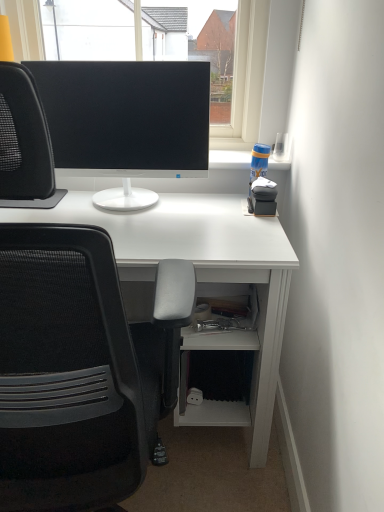
From the picture: What is the approximate height of black mesh chair at left?

black mesh chair at left is 1.17 meters in height.

Where is `black matte monitor at upper center`? black matte monitor at upper center is located at coordinates coord(220,55).

Considering the relative sizes of matte black monitor at center and black mesh chair at left in the image provided, is matte black monitor at center thinner than black mesh chair at left?

Indeed, matte black monitor at center has a lesser width compared to black mesh chair at left.

Does matte black monitor at center have a larger size compared to black mesh chair at left?

No.

From a real-world perspective, is matte black monitor at center located higher than black mesh chair at left?

Yes.

Which of these two, matte black monitor at center or black mesh chair at left, stands taller?

With more height is black mesh chair at left.

Where is `window screen located behind the black mesh chair at left`? The height and width of the screenshot is (512, 384). window screen located behind the black mesh chair at left is located at coordinates (220, 55).

Does black matte monitor at upper center appear on the left side of black mesh chair at left?

No, black matte monitor at upper center is not to the left of black mesh chair at left.

From the image's perspective, who appears lower, black matte monitor at upper center or black mesh chair at left?

From the image's view, black mesh chair at left is below.

Can you confirm if black mesh chair at left is positioned to the left of matte black monitor at center?

Correct, you'll find black mesh chair at left to the left of matte black monitor at center.

Based on the photo, considering the sizes of black mesh chair at left and matte black monitor at center in the image, is black mesh chair at left wider or thinner than matte black monitor at center?

black mesh chair at left is wider than matte black monitor at center.

This screenshot has width=384, height=512. I want to click on chair below the matte black monitor at center (from the image's perspective), so click(66, 373).

Is black mesh chair at left not within black matte monitor at upper center?

Yes, black mesh chair at left is outside of black matte monitor at upper center.

Could you tell me if black mesh chair at left is facing black matte monitor at upper center?

Yes, black mesh chair at left is oriented towards black matte monitor at upper center.

From a real-world perspective, is black mesh chair at left above or below black matte monitor at upper center?

black mesh chair at left is situated lower than black matte monitor at upper center in the real world.

How many degrees apart are the facing directions of black mesh chair at left and black matte monitor at upper center?

They differ by 180 degrees in their facing directions.

Is point (225, 62) positioned behind point (174, 117)?

Yes, it is.

From the image's perspective, between black matte monitor at upper center and matte black monitor at center, which one is located above?

From the image's view, black matte monitor at upper center is above.

Locate an element on the screen. The width and height of the screenshot is (384, 512). computer monitor to the left of black matte monitor at upper center is located at coordinates (126, 122).

Does black matte monitor at upper center have a greater height compared to matte black monitor at center?

Yes, black matte monitor at upper center is taller than matte black monitor at center.

Identify the location of computer monitor below the black matte monitor at upper center (from the image's perspective). This screenshot has width=384, height=512. (126, 122).

From a real-world perspective, who is located higher, matte black monitor at center or black matte monitor at upper center?

black matte monitor at upper center is physically above.

Considering the points (80, 146) and (201, 28), which point is behind, point (80, 146) or point (201, 28)?

The point (201, 28) is farther.

Find the location of a particular element. The image size is (384, 512). computer monitor above the black mesh chair at left (from a real-world perspective) is located at coordinates (126, 122).

Identify the location of window screen on the right of black mesh chair at left. click(220, 55).

From the image, which object appears to be nearer to black matte monitor at upper center, matte black monitor at center or black mesh chair at left?

Among the two, matte black monitor at center is located nearer to black matte monitor at upper center.

Based on their spatial positions, is black mesh chair at left or matte black monitor at center further from black matte monitor at upper center?

black mesh chair at left lies further to black matte monitor at upper center than the other object.

From the image, which object appears to be nearer to black mesh chair at left, matte black monitor at center or black matte monitor at upper center?

The object closer to black mesh chair at left is matte black monitor at center.

Estimate the real-world distances between objects in this image. Which object is closer to matte black monitor at center, black matte monitor at upper center or black mesh chair at left?

The object closer to matte black monitor at center is black matte monitor at upper center.

When comparing their distances from black mesh chair at left, does black matte monitor at upper center or matte black monitor at center seem closer?

Based on the image, matte black monitor at center appears to be nearer to black mesh chair at left.

From the image, which object appears to be nearer to matte black monitor at center, black mesh chair at left or black matte monitor at upper center?

Based on the image, black matte monitor at upper center appears to be nearer to matte black monitor at center.

Where is `computer monitor between black mesh chair at left and black matte monitor at upper center in the front-back direction`? computer monitor between black mesh chair at left and black matte monitor at upper center in the front-back direction is located at coordinates (126, 122).